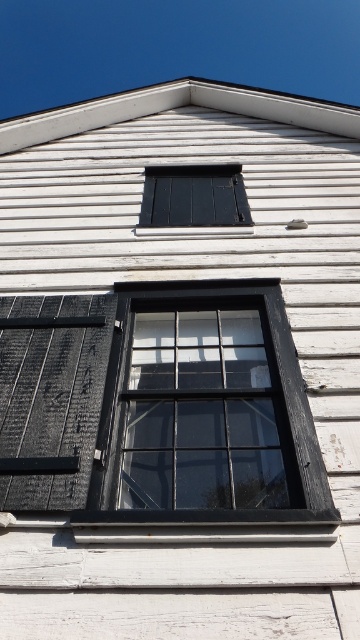
You are standing in front of the building and notice the black wood shutter at left and the matte black window at center. Which object is positioned lower in the image?

The black wood shutter at left is located below the matte black window at center, so it is positioned lower in the image.

You are an architect examining the building facade. You notice the black wood shutter at left and the matte black window at center. Which object is closer to you from your viewing position?

The black wood shutter at left is closer to you because it is in front of the matte black window at center.

You are an architect analyzing the building facade. You need to determine if the black wood shutter at left can cover the matte black window at center completely when closed. Based on their heights, what do you conclude?

The black wood shutter at left has a greater height compared to matte black window at center, so it can cover the matte black window at center completely when closed.